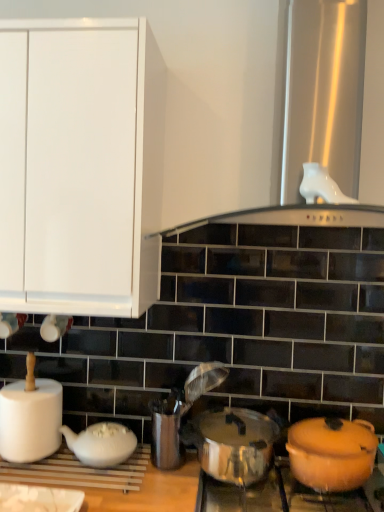
This screenshot has height=512, width=384. What are the coordinates of `free point below white matte teapot at lower left (from a real-world perspective)` in the screenshot? It's located at (94, 466).